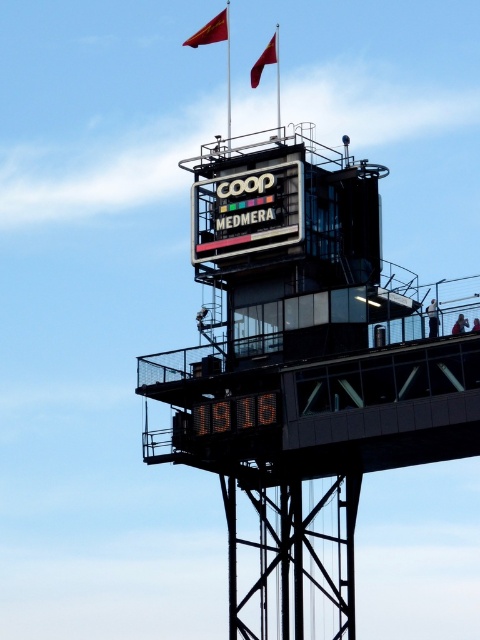
Question: Which object is positioned closest to the black glossy signboard at center?

Choices:
 (A) red fabric flag at upper center
 (B) black metal sign at upper center
 (C) digital orange numbers at center

Answer: (B)

Question: Is red fabric flag at upper center above red fabric flag at top?

Choices:
 (A) yes
 (B) no

Answer: (A)

Question: Can you confirm if digital orange numbers at center is thinner than red fabric flag at top?

Choices:
 (A) yes
 (B) no

Answer: (A)

Question: Which point is closer to the camera?

Choices:
 (A) black metal sign at upper center
 (B) red fabric flag at top
 (C) red fabric flag at upper center
 (D) black glossy signboard at center

Answer: (A)

Question: Does black glossy signboard at center have a greater width compared to red fabric flag at upper center?

Choices:
 (A) yes
 (B) no

Answer: (A)

Question: Which of the following is the farthest from the observer?

Choices:
 (A) (235, 209)
 (B) (273, 61)
 (C) (151, 365)
 (D) (219, 416)

Answer: (B)